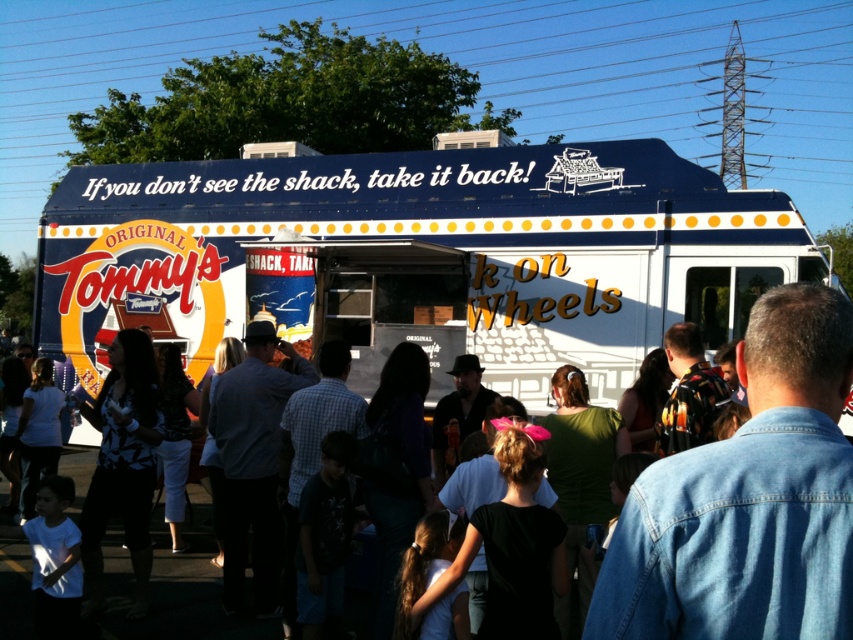
Between blue painted truck at center and denim jacket at center, which one appears on the left side from the viewer's perspective?

From the viewer's perspective, denim jacket at center appears more on the left side.

Where is `blue painted truck at center`? This screenshot has height=640, width=853. blue painted truck at center is located at coordinates (416, 257).